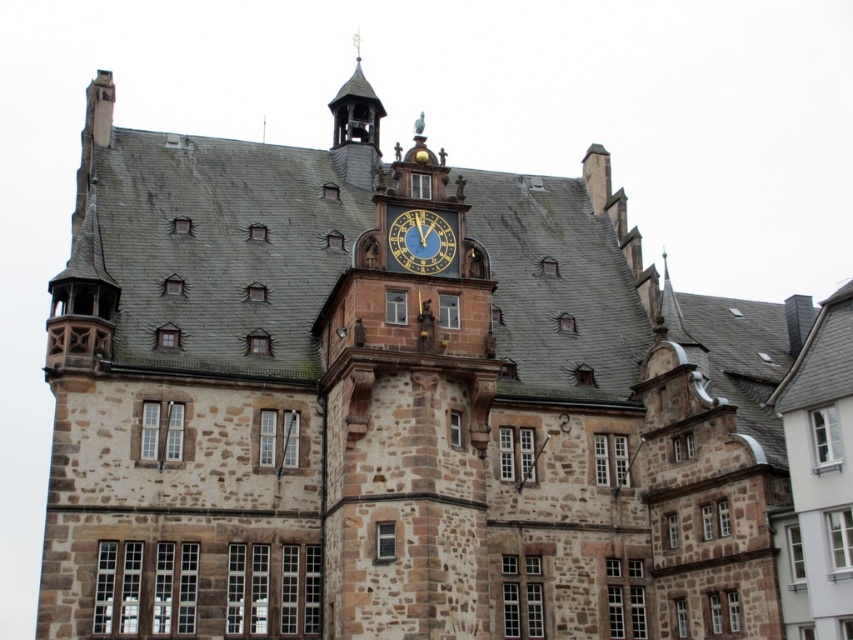
Based on the photo, which is above, polished brass bell tower at upper center or blue painted metal clock at center?

polished brass bell tower at upper center is higher up.

Between polished brass bell tower at upper center and blue painted metal clock at center, which one appears on the right side from the viewer's perspective?

blue painted metal clock at center is more to the right.

Between point (375, 145) and point (399, 225), which one is positioned in front?

Point (399, 225) is in front.

Identify the location of polished brass bell tower at upper center. (357, 129).